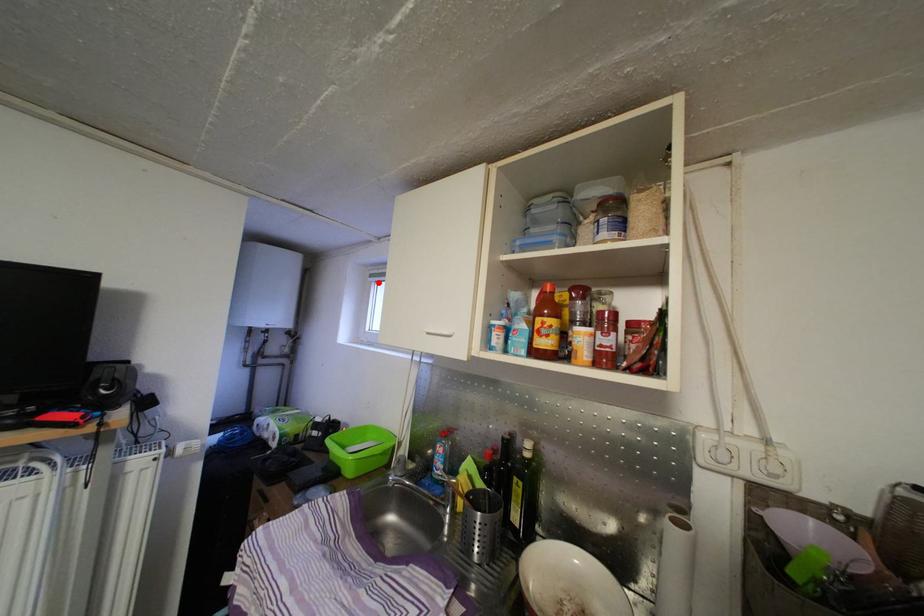
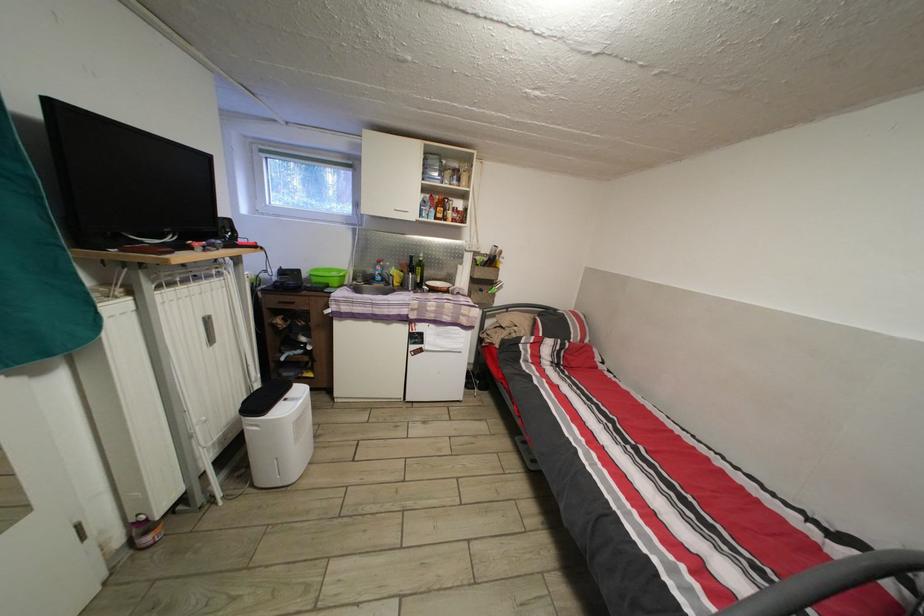
In the second image, find the point that corresponds to the highlighted location in the first image.

(269, 156)